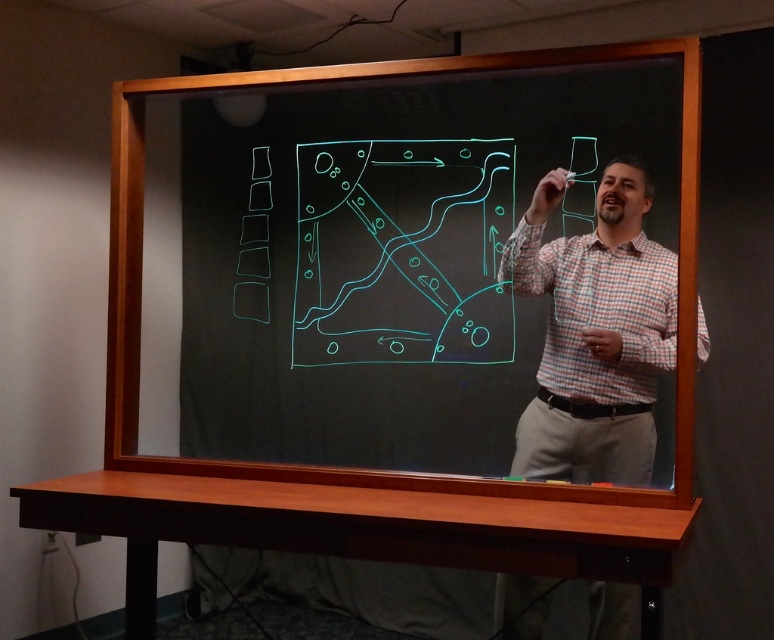
Question: Can you confirm if blackboard at center is positioned to the right of plaid shirt at center?

Choices:
 (A) no
 (B) yes

Answer: (A)

Question: From the image, what is the correct spatial relationship of blackboard at center in relation to plaid shirt at center?

Choices:
 (A) below
 (B) above

Answer: (B)

Question: Among these objects, which one is nearest to the camera?

Choices:
 (A) blackboard at center
 (B) plaid shirt at center

Answer: (B)

Question: Can you confirm if blackboard at center is wider than plaid shirt at center?

Choices:
 (A) yes
 (B) no

Answer: (A)

Question: Which of the following is the closest to the observer?

Choices:
 (A) (615, 157)
 (B) (327, 432)

Answer: (A)